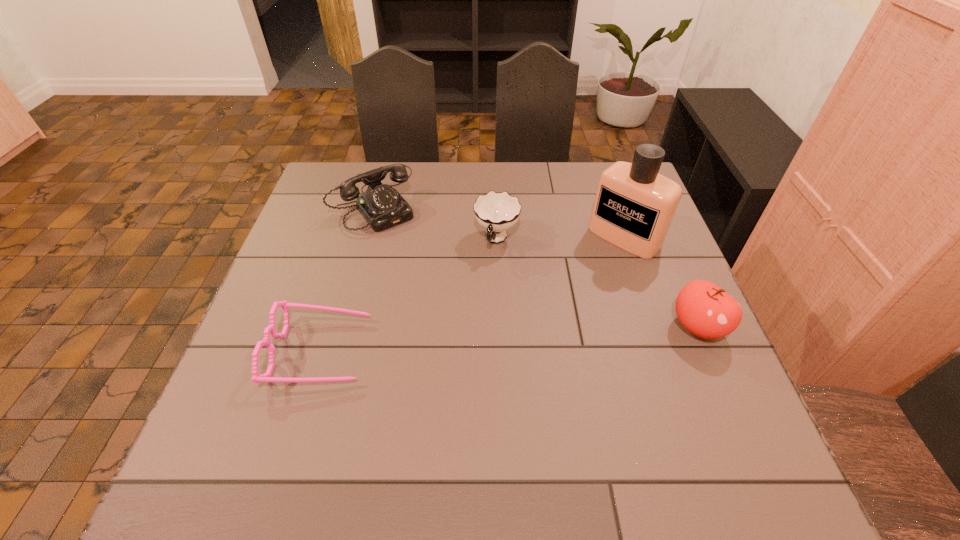
Image resolution: width=960 pixels, height=540 pixels. Identify the location of empty space that is in between the spectacles and the telephone. (349, 273).

Locate an element on the screen. The height and width of the screenshot is (540, 960). free area in between the apple and the telephone is located at coordinates (538, 261).

What are the coordinates of `unoccupied position between the apple and the cup` in the screenshot? It's located at (597, 283).

The width and height of the screenshot is (960, 540). In order to click on free space between the perfume and the cup in this screenshot , I will do `click(561, 238)`.

Locate an element on the screen. free space between the apple and the perfume is located at coordinates (661, 282).

Where is `free area in between the shortest object and the apple`? free area in between the shortest object and the apple is located at coordinates (510, 339).

Locate an element on the screen. vacant area that lies between the apple and the spectacles is located at coordinates (510, 339).

Identify the location of free space between the tallest object and the third object from left to right. This screenshot has width=960, height=540. (561, 238).

At what (x,y) coordinates should I click in order to perform the action: click on free space between the third object from left to right and the shortest object. Please return your answer as a coordinate pair (x, y). Looking at the image, I should click on (409, 295).

Locate an element on the screen. The width and height of the screenshot is (960, 540). object identified as the second closest to the telephone is located at coordinates (266, 377).